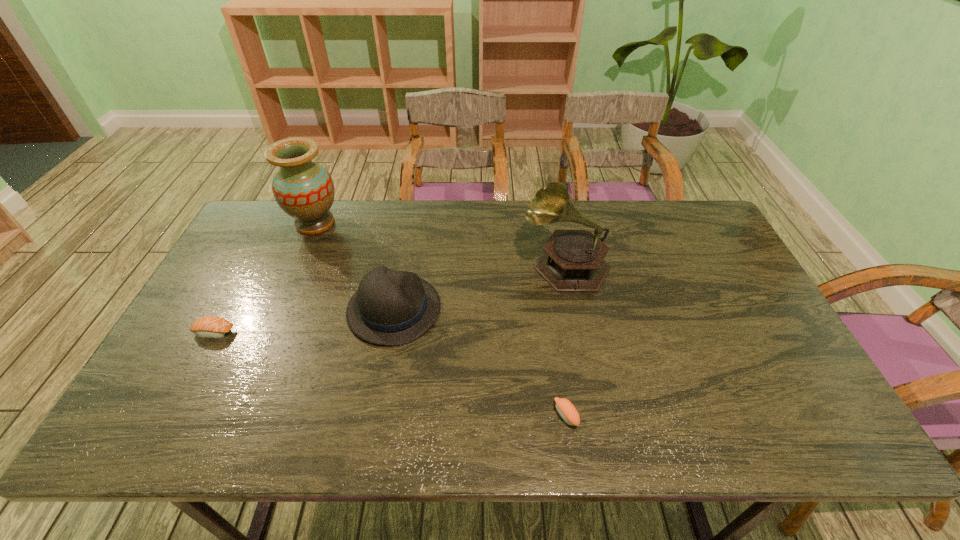
Identify the location of unoccupied area between the phonograph record and the vase. The height and width of the screenshot is (540, 960). (441, 244).

The width and height of the screenshot is (960, 540). What are the coordinates of `unoccupied position between the third shortest object and the farther sushi` in the screenshot? It's located at (304, 321).

In order to click on blank region between the right sushi and the bowler hat in this screenshot , I will do `click(480, 362)`.

Locate an element on the screen. The width and height of the screenshot is (960, 540). vacant point located between the second tallest object and the nearest object is located at coordinates (566, 339).

Where is `vacant point located between the bowler hat and the left sushi`? The image size is (960, 540). vacant point located between the bowler hat and the left sushi is located at coordinates (304, 321).

Find the location of a particular element. the fourth closest object relative to the third tallest object is located at coordinates (565, 408).

Where is `the third closest object to the phonograph record`? This screenshot has height=540, width=960. the third closest object to the phonograph record is located at coordinates (303, 189).

In order to click on free spot that satisfies the following two spatial constraints: 1. on the horn direction of the phonograph record; 2. on the front side of the farther sushi in this screenshot , I will do `click(580, 333)`.

At what (x,y) coordinates should I click in order to perform the action: click on free space that satisfies the following two spatial constraints: 1. on the front-facing side of the third tallest object; 2. on the right side of the right sushi. Please return your answer as a coordinate pair (x, y). Looking at the image, I should click on (375, 415).